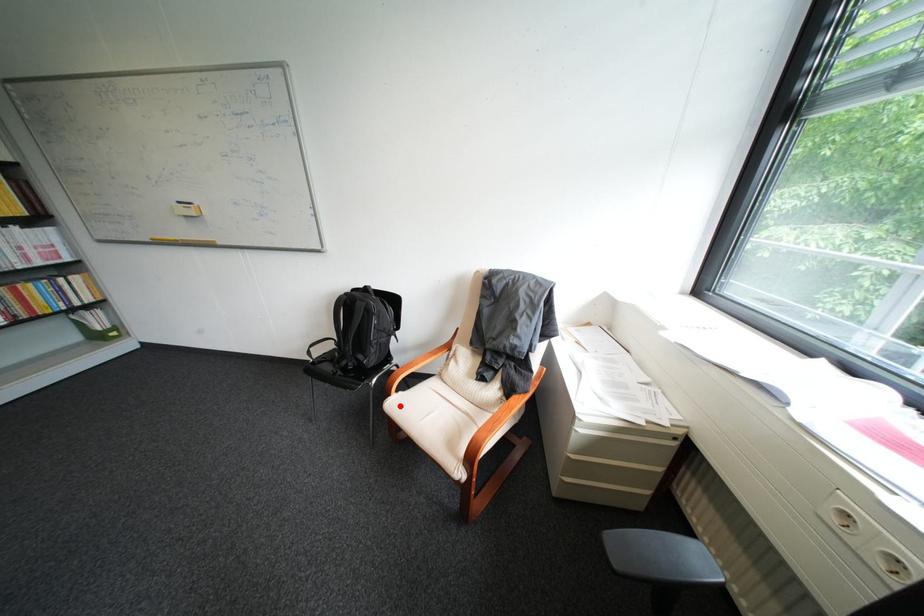
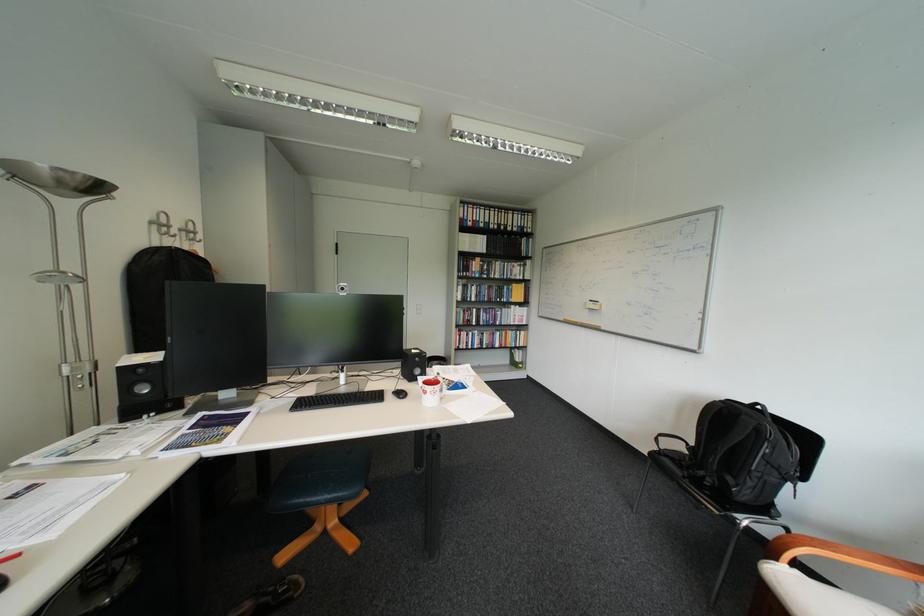
Locate, in the second image, the point that corresponds to the highlighted location in the first image.

(783, 572)